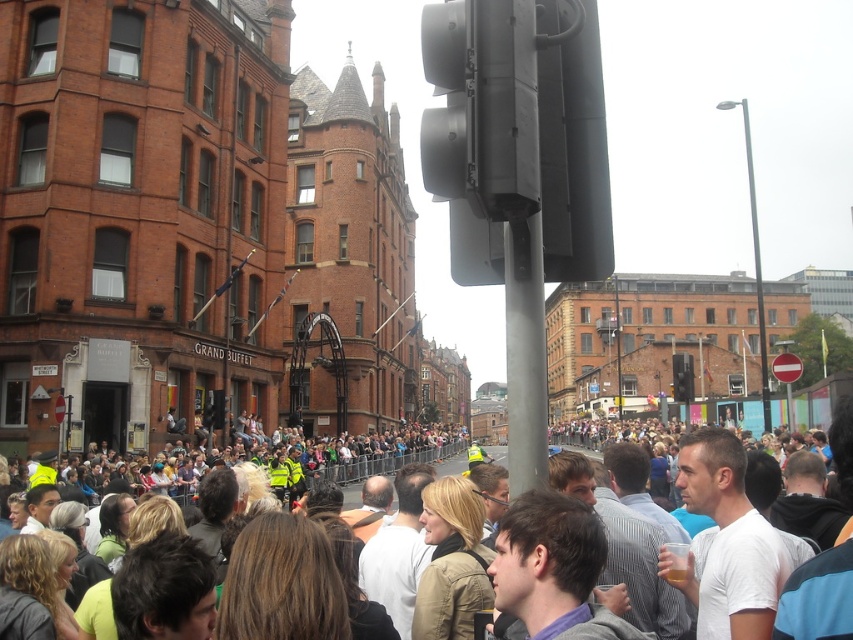
Question: Which point is closer to the camera?

Choices:
 (A) (215, 419)
 (B) (682, 381)
 (C) (521, 416)

Answer: (C)

Question: Which object is the farthest from the metallic traffic light at center?

Choices:
 (A) white casual clothing at center
 (B) black matte traffic light at upper center
 (C) black plastic traffic light at center
 (D) metallic gray pole at center

Answer: (C)

Question: Considering the relative positions of metallic gray pole at center and metallic traffic light at center in the image provided, where is metallic gray pole at center located with respect to metallic traffic light at center?

Choices:
 (A) right
 (B) left

Answer: (A)

Question: Which point is closer to the camera?

Choices:
 (A) black matte traffic light at upper center
 (B) metallic traffic light at center

Answer: (A)

Question: Can you confirm if black matte traffic light at upper center is smaller than metallic gray pole at center?

Choices:
 (A) no
 (B) yes

Answer: (B)

Question: Is black matte traffic light at upper center wider than metallic gray pole at center?

Choices:
 (A) yes
 (B) no

Answer: (A)